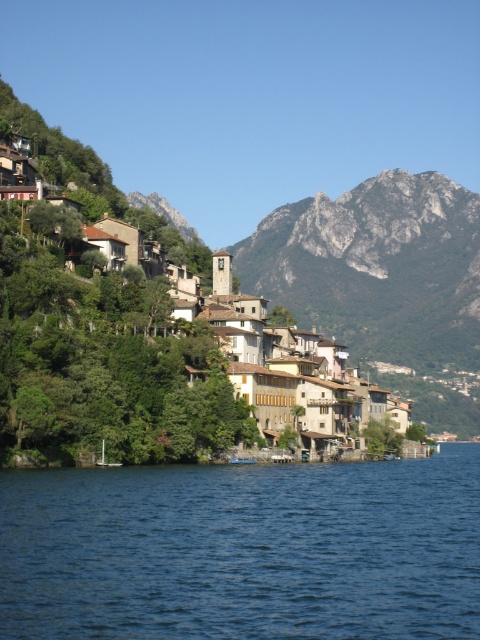
You are standing at the lakeside and want to take a photo of the brown wooden houses at center without the blue liquid water at lower center in the foreground. Is this possible given their positions?

The blue liquid water at lower center is in front of the brown wooden houses at center, so you cannot take a photo of the brown wooden houses at center without the blue liquid water at lower center in the foreground because the water is blocking the direct view.

In the scene shown: You are standing at the lakeside in the village and want to take a photo of the mountains. There are two points marked in the image. The first point is at coordinate point (62, 396) and the second is at point (355, 240). Which point should you stand at to have the mountains clearly visible without any obstruction from the village buildings?

You should stand at point (62, 396) because it is in front of point (355, 240), meaning it is closer to the mountains and less likely to be obstructed by the village buildings.